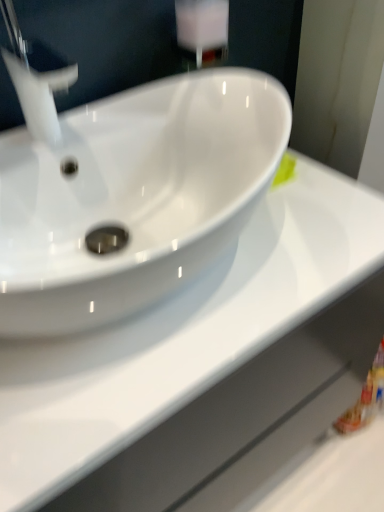
Question: From a real-world perspective, is white glossy faucet at upper left above or below white glossy counter top at center?

Choices:
 (A) above
 (B) below

Answer: (A)

Question: Would you say white glossy faucet at upper left is inside or outside white glossy counter top at center?

Choices:
 (A) outside
 (B) inside

Answer: (A)

Question: From the image's perspective, is white glossy faucet at upper left located above or below white glossy counter top at center?

Choices:
 (A) above
 (B) below

Answer: (A)

Question: From the image's perspective, is white glossy counter top at center positioned above or below white glossy faucet at upper left?

Choices:
 (A) above
 (B) below

Answer: (B)

Question: Based on their sizes in the image, would you say white glossy counter top at center is bigger or smaller than white glossy faucet at upper left?

Choices:
 (A) small
 (B) big

Answer: (B)

Question: Is white glossy counter top at center taller or shorter than white glossy faucet at upper left?

Choices:
 (A) short
 (B) tall

Answer: (B)

Question: Considering their positions, is white glossy counter top at center located in front of or behind white glossy faucet at upper left?

Choices:
 (A) behind
 (B) front

Answer: (B)